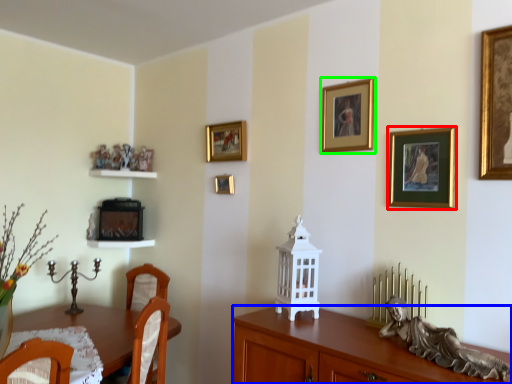
Question: Which is farther away from picture frame (highlighted by a red box)? cabinetry (highlighted by a blue box) or picture frame (highlighted by a green box)?

Choices:
 (A) cabinetry
 (B) picture frame

Answer: (A)